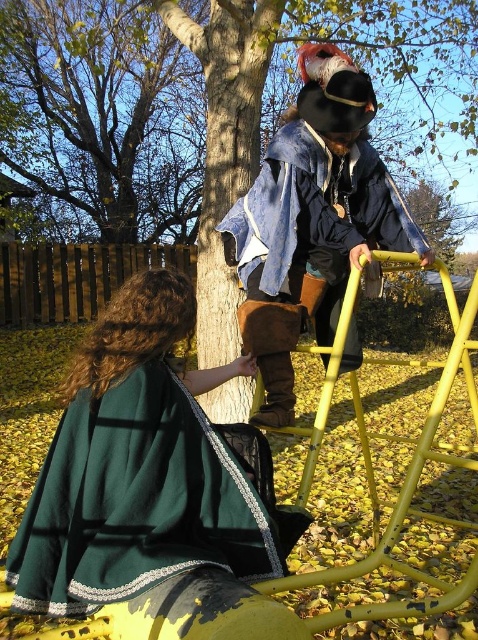
Question: Among these objects, which one is nearest to the camera?

Choices:
 (A) yellow metal ladder at upper right
 (B) smooth bark tree at upper left
 (C) green wool cape at lower left
 (D) smooth bark tree at center

Answer: (C)

Question: Can you confirm if green wool cape at lower left is wider than yellow metal ladder at upper right?

Choices:
 (A) no
 (B) yes

Answer: (A)

Question: Which point is farther from the camera taking this photo?

Choices:
 (A) [x=149, y=216]
 (B) [x=473, y=397]
 (C) [x=76, y=612]
 (D) [x=365, y=244]

Answer: (A)

Question: Which of the following is the closest to the observer?

Choices:
 (A) yellow metal ladder at upper right
 (B) denim fabric pirate at upper center

Answer: (A)

Question: Is green wool cape at lower left smaller than denim fabric pirate at upper center?

Choices:
 (A) no
 (B) yes

Answer: (B)

Question: Does smooth bark tree at center appear under yellow metal ladder at upper right?

Choices:
 (A) no
 (B) yes

Answer: (A)